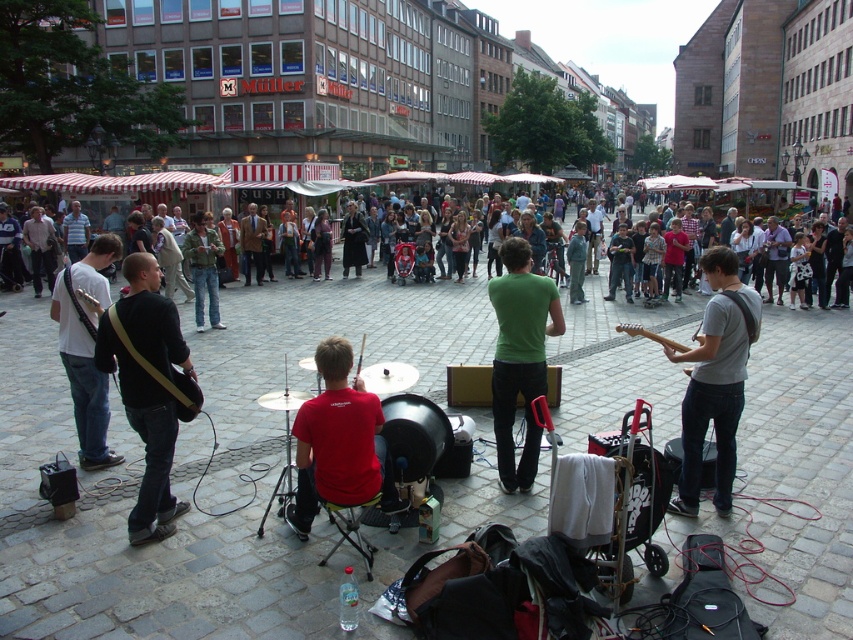
Question: Does green matte shirt at center come in front of matte black guitar at left?

Choices:
 (A) no
 (B) yes

Answer: (B)

Question: Which point appears farthest from the camera in this image?

Choices:
 (A) (720, 365)
 (B) (102, 188)

Answer: (B)

Question: Observing the image, what is the correct spatial positioning of gray fabric guitar at center in reference to multicolored casual clothing at center?

Choices:
 (A) right
 (B) left

Answer: (A)

Question: Does gray fabric guitar at center come in front of multicolored casual clothing at center?

Choices:
 (A) yes
 (B) no

Answer: (A)

Question: Estimate the real-world distances between objects in this image. Which object is farther from the black leather guitar at left?

Choices:
 (A) multicolored casual clothing at center
 (B) matte black guitar at left
 (C) gray fabric guitar at center

Answer: (A)

Question: Which object appears farthest from the camera in this image?

Choices:
 (A) matte black guitar at left
 (B) gray fabric guitar at center
 (C) black leather guitar at left

Answer: (A)